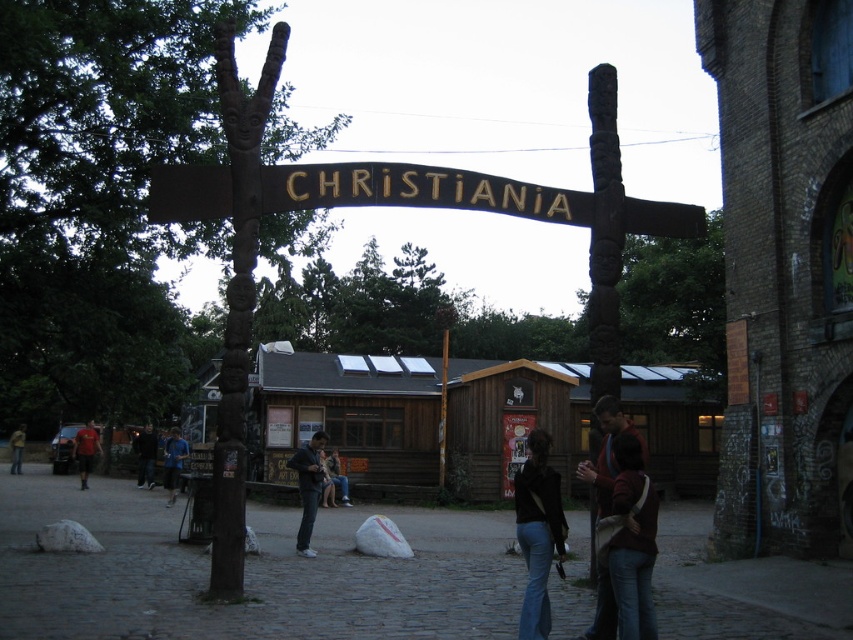
You are standing at the entrance of Christiania and want to take a photo of the wooden archway. If you move 50 feet closer to the point at coordinates point (578,472), will you be within 60 feet of it?

The point at coordinates point (578,472) is currently 112.57 feet from the camera. Moving 50 feet closer would bring you to 62.57 feet away, which is still just beyond the 60 feet threshold. Therefore, you would not be within 60 feet of it.